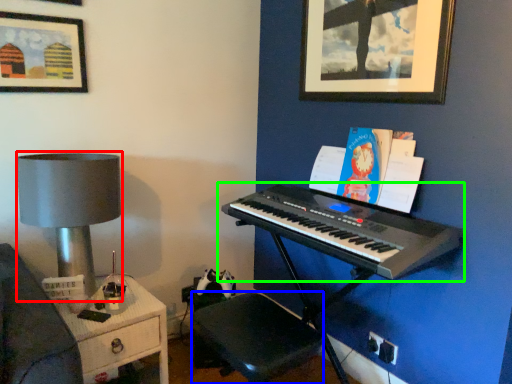
Question: Considering the real-world distances, which object is farthest from table lamp (highlighted by a red box)? music stool (highlighted by a blue box) or musical keyboard (highlighted by a green box)?

Choices:
 (A) music stool
 (B) musical keyboard

Answer: (B)